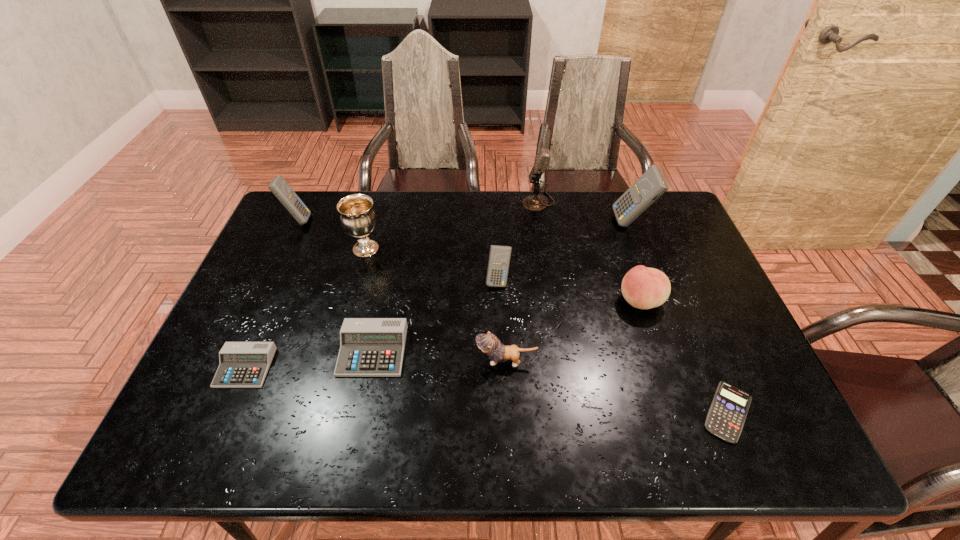
You are a GUI agent. You are given a task and a screenshot of the screen. Output one action in this format:
    pyautogui.click(x=<x>, y=<y>)
    Task: Click on the farthest object
    The height and width of the screenshot is (540, 960).
    Given the screenshot: What is the action you would take?
    pyautogui.click(x=535, y=203)

At what (x,y) coordinates should I click in order to perform the action: click on microphone. Please return your answer as a coordinate pair (x, y). The height and width of the screenshot is (540, 960). Looking at the image, I should click on (535, 203).

Image resolution: width=960 pixels, height=540 pixels. What are the coordinates of `the biggest blue calculator` in the screenshot? It's located at (651, 185).

Image resolution: width=960 pixels, height=540 pixels. Find the location of `the seventh nearest object`. the seventh nearest object is located at coordinates (358, 219).

Image resolution: width=960 pixels, height=540 pixels. Find the location of `the leftmost blue calculator`. the leftmost blue calculator is located at coordinates (279, 187).

I want to click on the third smallest blue calculator, so click(x=279, y=187).

The width and height of the screenshot is (960, 540). Find the location of `the third calculator from right to left`. the third calculator from right to left is located at coordinates (499, 258).

I want to click on the third biggest blue calculator, so click(x=499, y=258).

This screenshot has height=540, width=960. In order to click on peach in this screenshot , I will do `click(644, 288)`.

The image size is (960, 540). Find the location of `kitten`. kitten is located at coordinates (488, 343).